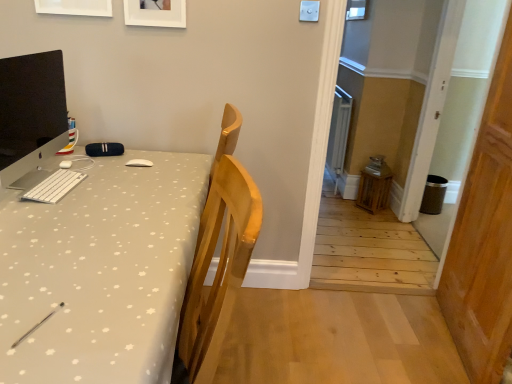
Question: Would you say white matte picture frame at upper center, the first picture frame from the left, is to the left or to the right of white matte keyboard at left in the picture?

Choices:
 (A) left
 (B) right

Answer: (A)

Question: From the image's perspective, is white matte picture frame at upper center, the first picture frame from the left, positioned above or below white matte keyboard at left?

Choices:
 (A) above
 (B) below

Answer: (A)

Question: Estimate the real-world distances between objects in this image. Which object is closer to the white matte picture frame at upper center, the first picture frame from the left?

Choices:
 (A) matte black monitor at left
 (B) white matte picture frame at upper center, which appears as the 2th picture frame when viewed from the left
 (C) white fabric desk at left
 (D) wooden door at right
 (E) white matte keyboard at left

Answer: (B)

Question: Which object is positioned farthest from the white matte picture frame at upper center, which is counted as the first picture frame, starting from the right?

Choices:
 (A) white matte keyboard at left
 (B) white fabric desk at left
 (C) wooden door at right
 (D) white matte picture frame at upper center, arranged as the second picture frame when viewed from the right
 (E) matte black monitor at left

Answer: (C)